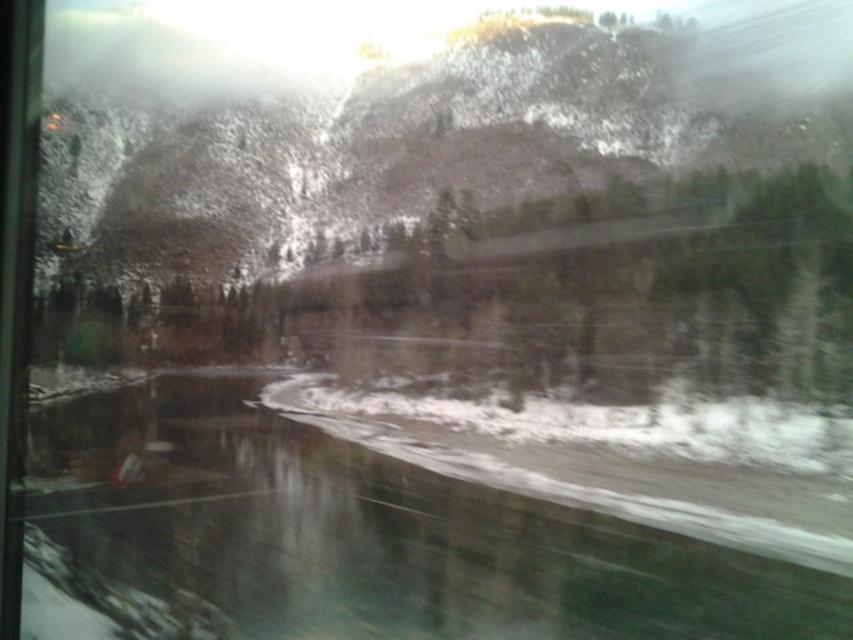
Between clear water at bottom and white powdery snow at center, which one has more height?

clear water at bottom is taller.

Who is shorter, clear water at bottom or white powdery snow at center?

white powdery snow at center is shorter.

Is point (120, 618) behind point (612, 428)?

No.

Find the location of a particular element. This screenshot has width=853, height=640. clear water at bottom is located at coordinates (347, 540).